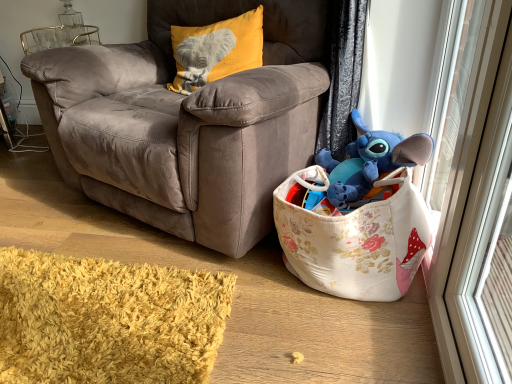
Question: Does velvet yellow pillow with elephant design at upper left have a larger size compared to transparent glass screen door at right?

Choices:
 (A) yes
 (B) no

Answer: (A)

Question: Does velvet yellow pillow with elephant design at upper left have a smaller size compared to transparent glass screen door at right?

Choices:
 (A) no
 (B) yes

Answer: (A)

Question: Can we say velvet yellow pillow with elephant design at upper left lies outside transparent glass screen door at right?

Choices:
 (A) yes
 (B) no

Answer: (A)

Question: Is velvet yellow pillow with elephant design at upper left to the left of transparent glass screen door at right from the viewer's perspective?

Choices:
 (A) no
 (B) yes

Answer: (B)

Question: Is velvet yellow pillow with elephant design at upper left turned away from transparent glass screen door at right?

Choices:
 (A) no
 (B) yes

Answer: (A)

Question: Considering the positions of velvet yellow pillow with elephant design at upper left and transparent glass screen door at right in the image, is velvet yellow pillow with elephant design at upper left wider or thinner than transparent glass screen door at right?

Choices:
 (A) wide
 (B) thin

Answer: (A)

Question: From a real-world perspective, is velvet yellow pillow with elephant design at upper left above or below transparent glass screen door at right?

Choices:
 (A) below
 (B) above

Answer: (B)

Question: In the image, is velvet yellow pillow with elephant design at upper left positioned in front of or behind transparent glass screen door at right?

Choices:
 (A) front
 (B) behind

Answer: (B)

Question: Considering the relative positions of velvet yellow pillow with elephant design at upper left and transparent glass screen door at right in the image provided, is velvet yellow pillow with elephant design at upper left to the left or to the right of transparent glass screen door at right?

Choices:
 (A) left
 (B) right

Answer: (A)

Question: In the image, is floral fabric toy basket at lower right positioned in front of or behind blue plush toy at upper right?

Choices:
 (A) behind
 (B) front

Answer: (B)

Question: From the image's perspective, relative to blue plush toy at upper right, is floral fabric toy basket at lower right above or below?

Choices:
 (A) above
 (B) below

Answer: (B)

Question: Considering the positions of floral fabric toy basket at lower right and blue plush toy at upper right in the image, is floral fabric toy basket at lower right bigger or smaller than blue plush toy at upper right?

Choices:
 (A) big
 (B) small

Answer: (A)

Question: From a real-world perspective, is floral fabric toy basket at lower right physically located above or below blue plush toy at upper right?

Choices:
 (A) below
 (B) above

Answer: (A)

Question: Is blue plush toy at upper right situated inside transparent glass screen door at right or outside?

Choices:
 (A) inside
 (B) outside

Answer: (B)

Question: Is blue plush toy at upper right taller or shorter than transparent glass screen door at right?

Choices:
 (A) short
 (B) tall

Answer: (A)